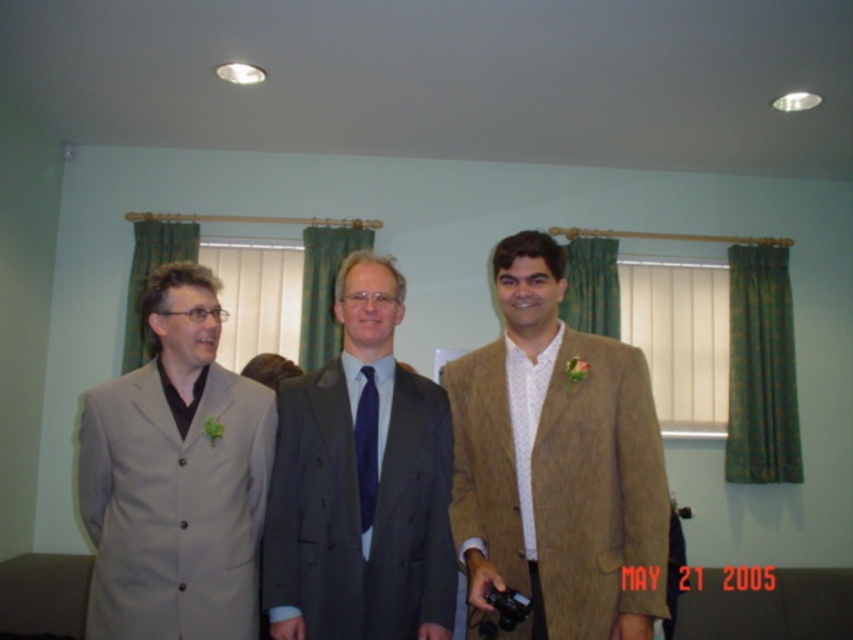
Question: Considering the relative positions of matte beige suit at left and matte gray suit at center in the image provided, where is matte beige suit at left located with respect to matte gray suit at center?

Choices:
 (A) below
 (B) above

Answer: (A)

Question: Which of the following is the farthest from the observer?

Choices:
 (A) tan textured suit at center
 (B) navy blue silk tie at center
 (C) matte gray suit at center

Answer: (B)

Question: Does tan textured suit at center appear on the left side of matte beige suit at left?

Choices:
 (A) yes
 (B) no

Answer: (B)

Question: Which of the following is the closest to the observer?

Choices:
 (A) tan textured suit at center
 (B) matte beige suit at left
 (C) matte gray suit at center

Answer: (A)

Question: Which object appears farthest from the camera in this image?

Choices:
 (A) navy blue silk tie at center
 (B) tan textured suit at center

Answer: (A)

Question: Observing the image, what is the correct spatial positioning of matte gray suit at center in reference to navy blue silk tie at center?

Choices:
 (A) right
 (B) left

Answer: (B)